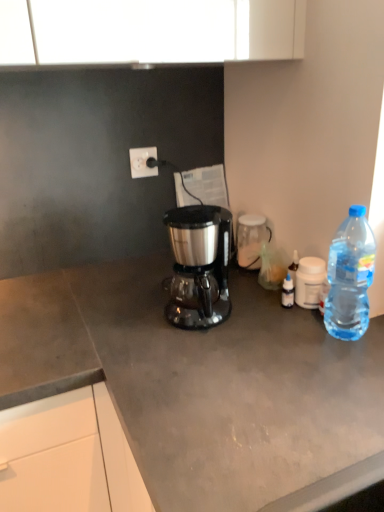
What do you see at coordinates (142, 162) in the screenshot? The image size is (384, 512). I see `white plastic power outlet at upper center` at bounding box center [142, 162].

What do you see at coordinates (350, 276) in the screenshot?
I see `clear plastic bottle at right` at bounding box center [350, 276].

The width and height of the screenshot is (384, 512). What are the coordinates of `transparent plastic coffee cup at right, the 1th coffee cup positioned from the right` in the screenshot? It's located at coord(309,281).

What do you see at coordinates (309, 281) in the screenshot? The image size is (384, 512). I see `transparent plastic coffee cup at right, the 1th coffee cup positioned from the right` at bounding box center [309, 281].

Where is `satin black coffee maker at center`? The width and height of the screenshot is (384, 512). satin black coffee maker at center is located at coordinates (199, 266).

What do you see at coordinates (251, 240) in the screenshot? The width and height of the screenshot is (384, 512). I see `transparent glass jar at center, arranged as the 1th coffee cup when viewed from the back` at bounding box center [251, 240].

What is the approximate height of matte gray countertop at center?

The height of matte gray countertop at center is 33.79 inches.

Find the location of a particular element. The width and height of the screenshot is (384, 512). white plastic power outlet at upper center is located at coordinates coord(142,162).

Is transparent plastic coffee cup at right, the second coffee cup positioned from the back, at the left side of satin black coffee maker at center?

In fact, transparent plastic coffee cup at right, the second coffee cup positioned from the back, is to the right of satin black coffee maker at center.

Which of these two, transparent plastic coffee cup at right, arranged as the second coffee cup when viewed from the left, or satin black coffee maker at center, is wider?

satin black coffee maker at center is wider.

Can you confirm if transparent plastic coffee cup at right, arranged as the second coffee cup when viewed from the left, is shorter than satin black coffee maker at center?

Yes.

Is transparent plastic coffee cup at right, the first coffee cup positioned from the front, turned away from satin black coffee maker at center?

No, transparent plastic coffee cup at right, the first coffee cup positioned from the front, is not facing away from satin black coffee maker at center.

You are a GUI agent. You are given a task and a screenshot of the screen. Output one action in this format:
    pyautogui.click(x=<x>, y=<y>)
    Task: Click on the bottle above the transparent plastic coffee cup at right, the first coffee cup positioned from the front (from the image's perspective)
    
    Given the screenshot: What is the action you would take?
    pyautogui.click(x=350, y=276)

Is the surface of transparent plastic coffee cup at right, the second coffee cup positioned from the back, in direct contact with clear plastic bottle at right?

No, transparent plastic coffee cup at right, the second coffee cup positioned from the back, is not touching clear plastic bottle at right.

From the image's perspective, which one is positioned lower, transparent plastic coffee cup at right, the second coffee cup positioned from the back, or clear plastic bottle at right?

transparent plastic coffee cup at right, the second coffee cup positioned from the back, from the image's perspective.

Is transparent plastic coffee cup at right, arranged as the second coffee cup when viewed from the left, located outside clear plastic bottle at right?

transparent plastic coffee cup at right, arranged as the second coffee cup when viewed from the left, lies outside clear plastic bottle at right's area.

Consider the image. Considering the relative sizes of clear plastic bottle at right and satin black coffee maker at center in the image provided, is clear plastic bottle at right wider than satin black coffee maker at center?

No, clear plastic bottle at right is not wider than satin black coffee maker at center.

Considering the positions of point (363, 333) and point (169, 232), is point (363, 333) closer or farther from the camera than point (169, 232)?

Point (363, 333) is closer to the camera than point (169, 232).

Does clear plastic bottle at right have a lesser height compared to satin black coffee maker at center?

No.

Considering the positions of objects clear plastic bottle at right and satin black coffee maker at center in the image provided, who is more to the right, clear plastic bottle at right or satin black coffee maker at center?

From the viewer's perspective, clear plastic bottle at right appears more on the right side.

What's the angular difference between white plastic power outlet at upper center and clear plastic bottle at right's facing directions?

84.2 degrees separate the facing orientations of white plastic power outlet at upper center and clear plastic bottle at right.

Where is `bottle in front of the white plastic power outlet at upper center`? This screenshot has width=384, height=512. bottle in front of the white plastic power outlet at upper center is located at coordinates (350, 276).

Considering the relative sizes of white plastic power outlet at upper center and clear plastic bottle at right in the image provided, is white plastic power outlet at upper center wider than clear plastic bottle at right?

No.

Looking at this image, who is bigger, white plastic power outlet at upper center or clear plastic bottle at right?

clear plastic bottle at right.

Considering the relative positions of satin black coffee maker at center and transparent glass jar at center, positioned as the 1th coffee cup in left-to-right order, in the image provided, is satin black coffee maker at center behind transparent glass jar at center, positioned as the 1th coffee cup in left-to-right order,?

No, it is in front of transparent glass jar at center, positioned as the 1th coffee cup in left-to-right order.

How much distance is there between satin black coffee maker at center and transparent glass jar at center, arranged as the second coffee cup when viewed from the front?

A distance of 28.06 centimeters exists between satin black coffee maker at center and transparent glass jar at center, arranged as the second coffee cup when viewed from the front.

Can you confirm if satin black coffee maker at center is bigger than transparent glass jar at center, arranged as the second coffee cup when viewed from the front?

Yes, satin black coffee maker at center is bigger than transparent glass jar at center, arranged as the second coffee cup when viewed from the front.

This screenshot has width=384, height=512. I want to click on bottle lying above the transparent plastic coffee cup at right, arranged as the second coffee cup when viewed from the left (from the image's perspective), so click(350, 276).

From a real-world perspective, is clear plastic bottle at right beneath transparent plastic coffee cup at right, the second coffee cup positioned from the back?

No.

Is clear plastic bottle at right smaller than transparent plastic coffee cup at right, the 1th coffee cup positioned from the right?

Incorrect, clear plastic bottle at right is not smaller in size than transparent plastic coffee cup at right, the 1th coffee cup positioned from the right.

Is clear plastic bottle at right oriented towards transparent plastic coffee cup at right, the 1th coffee cup positioned from the right?

No.

Image resolution: width=384 pixels, height=512 pixels. Identify the location of the 2nd coffee cup located beneath the satin black coffee maker at center (from a real-world perspective). (309, 281).

Could you tell me if satin black coffee maker at center is turned towards transparent plastic coffee cup at right, arranged as the second coffee cup when viewed from the left?

No, satin black coffee maker at center is not facing towards transparent plastic coffee cup at right, arranged as the second coffee cup when viewed from the left.

Could you measure the distance between satin black coffee maker at center and transparent plastic coffee cup at right, arranged as the second coffee cup when viewed from the left?

satin black coffee maker at center is 10.47 inches from transparent plastic coffee cup at right, arranged as the second coffee cup when viewed from the left.

In the scene shown: Choose the correct answer: Is satin black coffee maker at center inside transparent plastic coffee cup at right, the 1th coffee cup positioned from the right, or outside it?

satin black coffee maker at center cannot be found inside transparent plastic coffee cup at right, the 1th coffee cup positioned from the right.

Locate an element on the screen. The image size is (384, 512). coffee maker above the transparent plastic coffee cup at right, the first coffee cup positioned from the front (from the image's perspective) is located at coordinates (199, 266).

Locate an element on the screen. bottle that is on the right side of transparent plastic coffee cup at right, arranged as the second coffee cup when viewed from the left is located at coordinates (350, 276).

Looking at the image, which one is located further to satin black coffee maker at center, matte gray countertop at center or clear plastic bottle at right?

clear plastic bottle at right lies further to satin black coffee maker at center than the other object.

Which object lies nearer to the anchor point clear plastic bottle at right, transparent glass jar at center, which is the second coffee cup from right to left, or satin black coffee maker at center?

satin black coffee maker at center.

Looking at the image, which one is located further to satin black coffee maker at center, matte gray countertop at center or white plastic power outlet at upper center?

white plastic power outlet at upper center is positioned further to the anchor satin black coffee maker at center.

Based on their spatial positions, is matte gray countertop at center or transparent glass jar at center, arranged as the second coffee cup when viewed from the front, closer to transparent plastic coffee cup at right, the first coffee cup positioned from the front?

transparent glass jar at center, arranged as the second coffee cup when viewed from the front, is closer to transparent plastic coffee cup at right, the first coffee cup positioned from the front.

Estimate the real-world distances between objects in this image. Which object is further from transparent glass jar at center, arranged as the second coffee cup when viewed from the front, satin black coffee maker at center or clear plastic bottle at right?

clear plastic bottle at right.

Which object lies further to the anchor point matte gray countertop at center, satin black coffee maker at center or white plastic power outlet at upper center?

white plastic power outlet at upper center is further to matte gray countertop at center.

Which object lies further to the anchor point transparent glass jar at center, positioned as the 1th coffee cup in left-to-right order, white plastic power outlet at upper center or transparent plastic coffee cup at right, the second coffee cup positioned from the back?

white plastic power outlet at upper center lies further to transparent glass jar at center, positioned as the 1th coffee cup in left-to-right order, than the other object.

When comparing their distances from clear plastic bottle at right, does satin black coffee maker at center or white plastic power outlet at upper center seem closer?

The object closer to clear plastic bottle at right is satin black coffee maker at center.

Find the location of `coffee cup between transparent glass jar at center, arranged as the second coffee cup when viewed from the front, and matte gray countertop at center from top to bottom`. coffee cup between transparent glass jar at center, arranged as the second coffee cup when viewed from the front, and matte gray countertop at center from top to bottom is located at coordinates (309, 281).

Where is `coffee cup between satin black coffee maker at center and matte gray countertop at center vertically`? The image size is (384, 512). coffee cup between satin black coffee maker at center and matte gray countertop at center vertically is located at coordinates (309, 281).

Locate an element on the screen. bottle between white plastic power outlet at upper center and matte gray countertop at center vertically is located at coordinates (350, 276).

The image size is (384, 512). I want to click on coffee cup between clear plastic bottle at right and transparent glass jar at center, arranged as the second coffee cup when viewed from the front, in the front-back direction, so click(x=309, y=281).